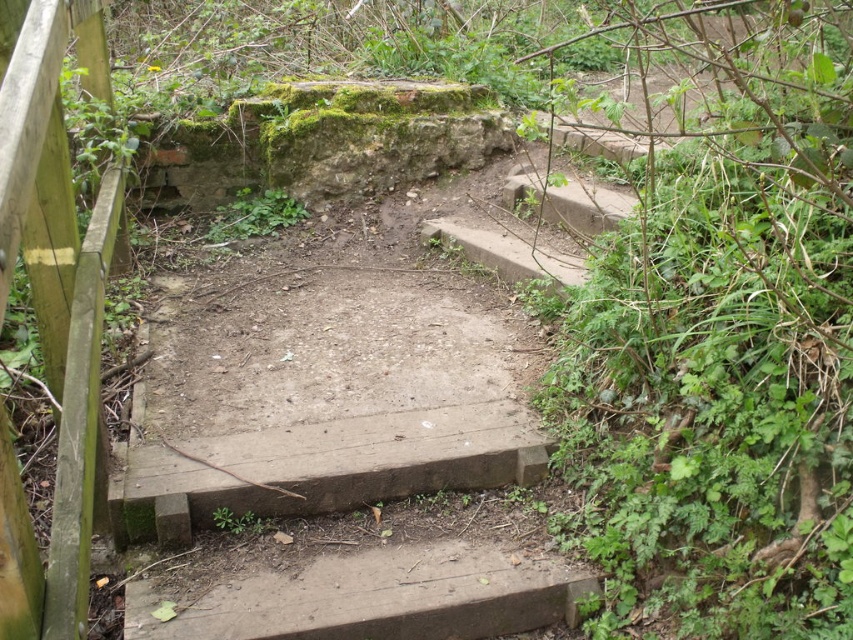
Image resolution: width=853 pixels, height=640 pixels. I want to click on green leafy plant at upper right, so click(720, 333).

Is point (712, 524) behind point (88, 556)?

Yes, it is.

The width and height of the screenshot is (853, 640). I want to click on green leafy plant at upper right, so click(x=720, y=333).